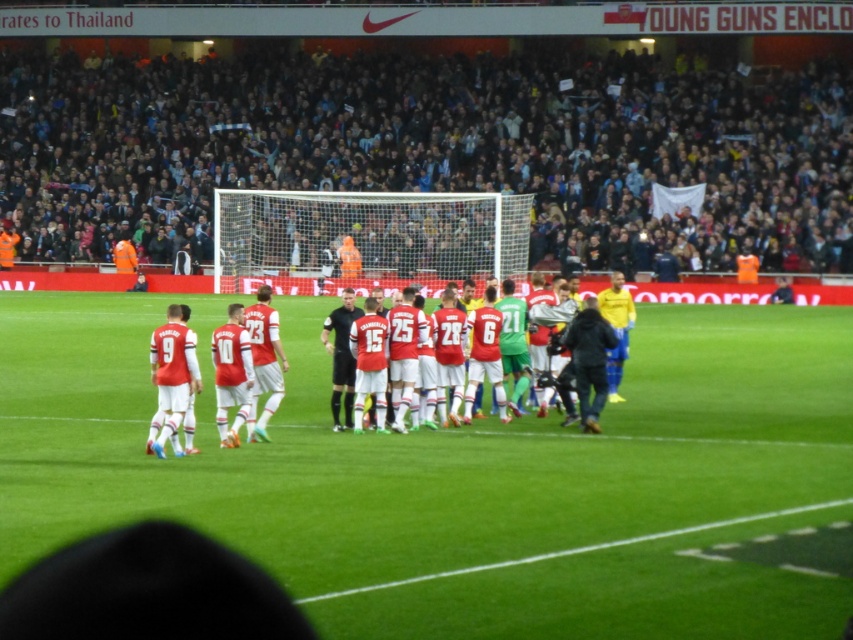
Is dark gray crowd at upper center positioned before red matte jersey at center?

No, dark gray crowd at upper center is further to the viewer.

Which is above, dark gray crowd at upper center or red matte jersey at center?

dark gray crowd at upper center is higher up.

Identify the location of dark gray crowd at upper center. The height and width of the screenshot is (640, 853). (433, 148).

Describe the element at coordinates (260, 356) in the screenshot. I see `red matte jersey at center` at that location.

Does red matte jersey at center have a greater height compared to black jersey at center?

Indeed, red matte jersey at center has a greater height compared to black jersey at center.

What do you see at coordinates (260, 356) in the screenshot?
I see `red matte jersey at center` at bounding box center [260, 356].

Find the location of a particular element. The height and width of the screenshot is (640, 853). red matte jersey at center is located at coordinates (260, 356).

Can you confirm if black jersey at center is shorter than yellow matte jersey at right?

Yes, black jersey at center is shorter than yellow matte jersey at right.

Which is behind, point (335, 321) or point (625, 333)?

Positioned behind is point (625, 333).

What do you see at coordinates (341, 356) in the screenshot? I see `black jersey at center` at bounding box center [341, 356].

Locate an element on the screen. This screenshot has width=853, height=640. black jersey at center is located at coordinates (341, 356).